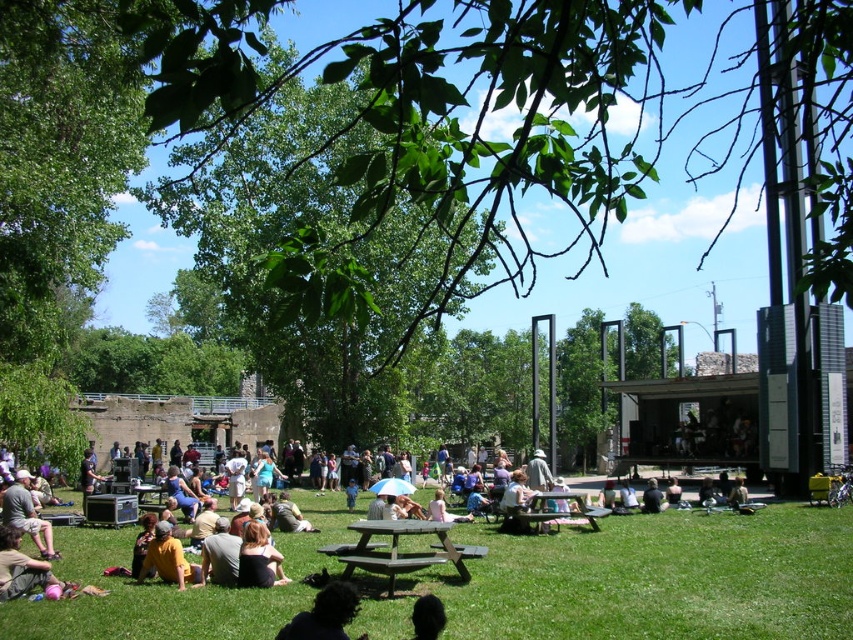
Which is below, light brown fabric pants at lower left or yellow casual clothing at center?

yellow casual clothing at center is lower down.

Consider the image. Between light brown fabric pants at lower left and yellow casual clothing at center, which one is positioned higher?

light brown fabric pants at lower left

Does point (50, 557) come in front of point (167, 536)?

No, (50, 557) is behind (167, 536).

The image size is (853, 640). I want to click on light brown fabric pants at lower left, so click(x=27, y=515).

Does point (440, 540) lie in front of point (419, 608)?

No, it is behind (419, 608).

Can you confirm if wooden picnic table at center is smaller than black hair at lower center?

Incorrect, wooden picnic table at center is not smaller in size than black hair at lower center.

Describe the element at coordinates (399, 552) in the screenshot. The image size is (853, 640). I see `wooden picnic table at center` at that location.

The image size is (853, 640). I want to click on wooden picnic table at center, so click(x=399, y=552).

How much distance is there between black hair at lower center and green fabric person at center?

black hair at lower center is 88.19 feet away from green fabric person at center.

Does black hair at lower center appear over green fabric person at center?

Actually, black hair at lower center is below green fabric person at center.

Which is in front, point (421, 628) or point (309, 525)?

Point (421, 628) is in front.

You are a GUI agent. You are given a task and a screenshot of the screen. Output one action in this format:
    pyautogui.click(x=<x>, y=<y>)
    Task: Click on the black hair at lower center
    The width and height of the screenshot is (853, 640).
    Given the screenshot: What is the action you would take?
    pyautogui.click(x=427, y=618)